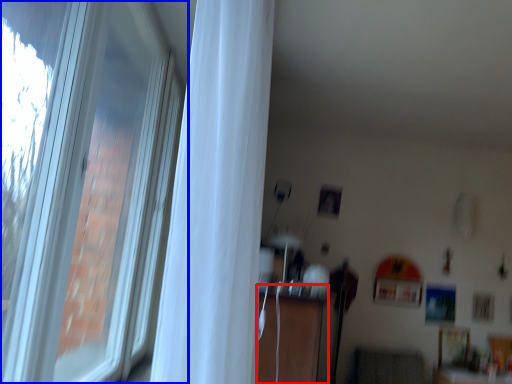
Question: Which object appears farthest to the camera in this image, dresser (highlighted by a red box) or window (highlighted by a blue box)?

Choices:
 (A) dresser
 (B) window

Answer: (A)